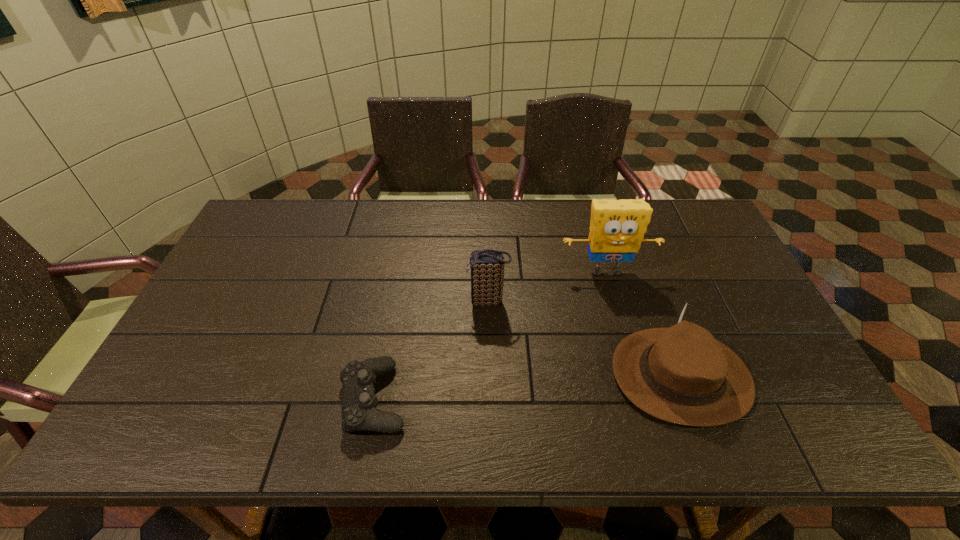
Where is `vacant space located 0.220m with the zip open on the clutch bag`? The image size is (960, 540). vacant space located 0.220m with the zip open on the clutch bag is located at coordinates (391, 302).

I want to click on vacant space located on the feather side of the fedora, so click(x=581, y=375).

Find the location of a particular element. The image size is (960, 540). vacant space situated on the feather side of the fedora is located at coordinates (508, 375).

Locate an element on the screen. This screenshot has width=960, height=540. free space located on the feather side of the fedora is located at coordinates (548, 375).

At what (x,y) coordinates should I click in order to perform the action: click on free space located on the left of the control. Please return your answer as a coordinate pair (x, y). Image resolution: width=960 pixels, height=540 pixels. Looking at the image, I should click on (276, 398).

Locate an element on the screen. fedora located at the near edge is located at coordinates (681, 374).

Identify the location of control positioned at the near edge. (359, 401).

The width and height of the screenshot is (960, 540). Identify the location of object that is positioned at the right edge. (681, 374).

Where is `object positioned at the near right corner`? The image size is (960, 540). object positioned at the near right corner is located at coordinates (681, 374).

Locate an element on the screen. Image resolution: width=960 pixels, height=540 pixels. vacant area at the far edge of the desktop is located at coordinates (372, 220).